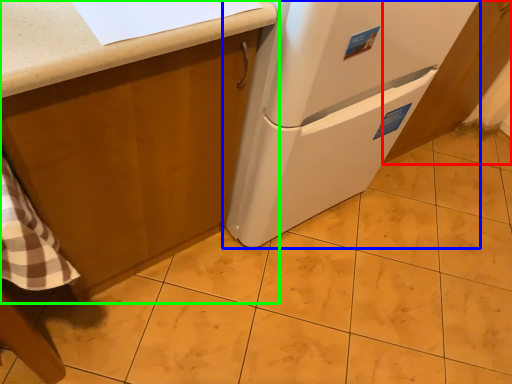
Question: Based on their relative distances, which object is farther from cabinetry (highlighted by a red box)? Choose from refrigerator (highlighted by a blue box) and cabinetry (highlighted by a green box).

Choices:
 (A) refrigerator
 (B) cabinetry

Answer: (B)